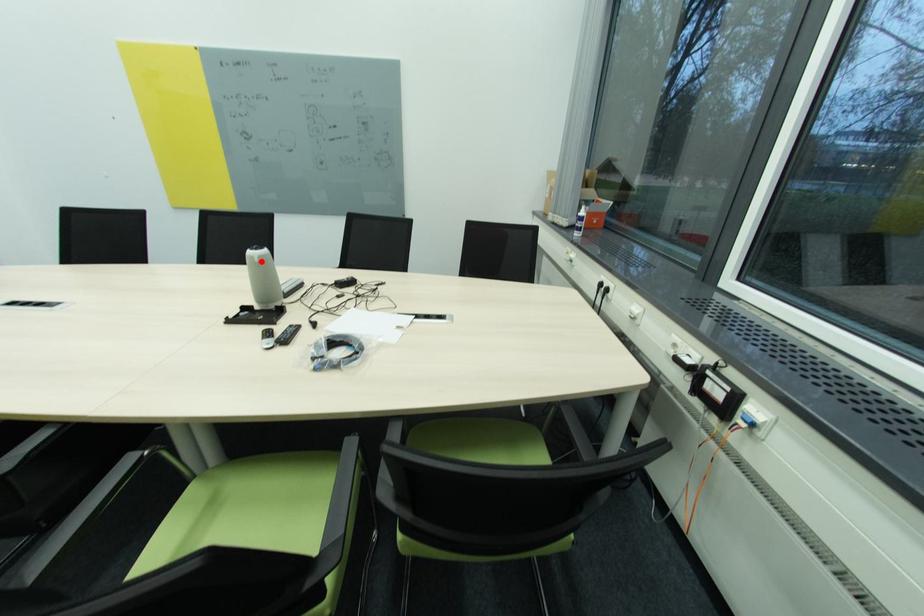
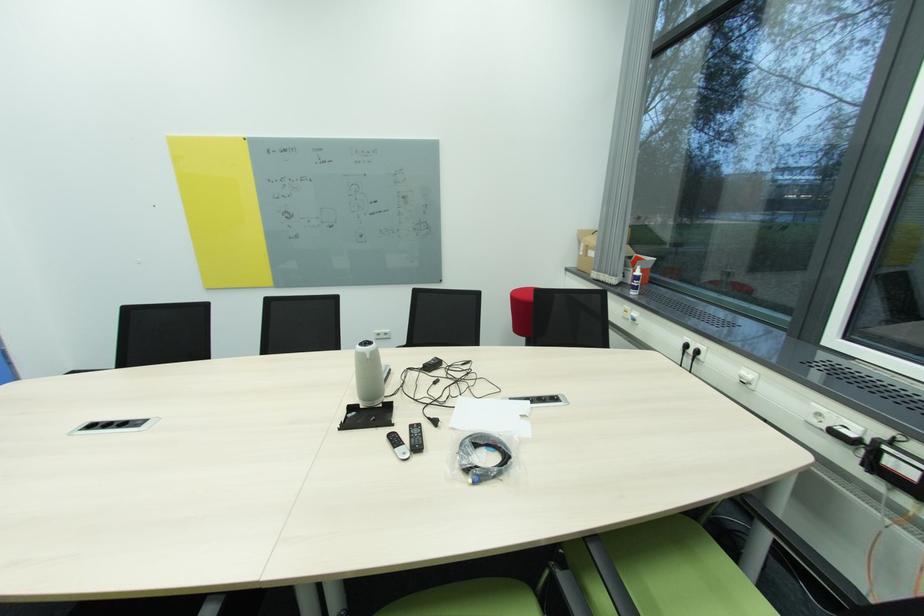
Locate, in the second image, the point that corresponds to the highlighted location in the first image.

(372, 358)